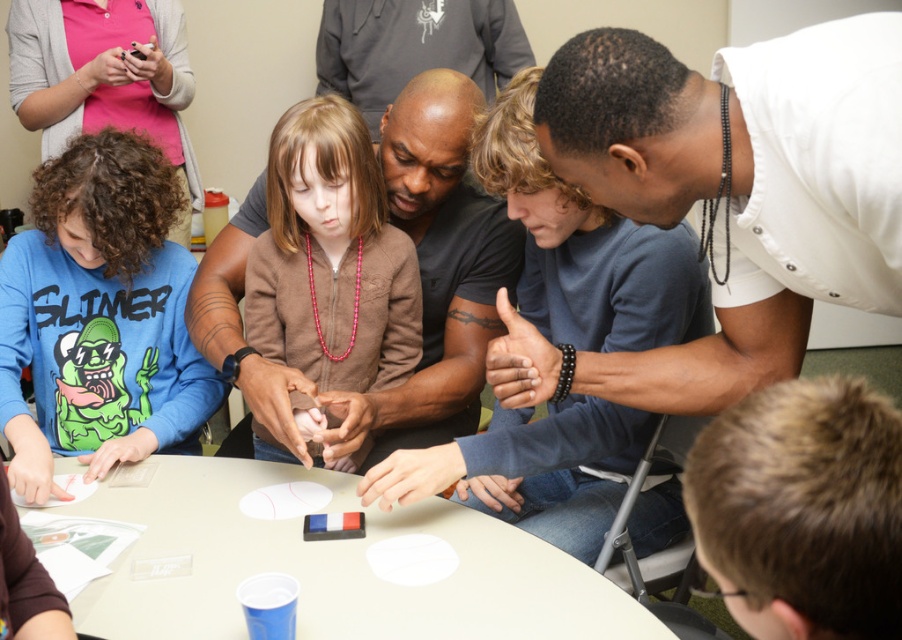
Question: Which object is farther from the camera taking this photo?

Choices:
 (A) smooth black shirt at center
 (B) white plastic table at center
 (C) blue cotton shirt at lower left

Answer: (C)

Question: Which is nearer to the white plastic table at center?

Choices:
 (A) smooth black shirt at center
 (B) brown matte sweater at center

Answer: (A)

Question: Can you confirm if blue cotton shirt at lower left is positioned below brown matte sweater at center?

Choices:
 (A) yes
 (B) no

Answer: (A)

Question: Is blue cotton shirt at lower left closer to camera compared to smooth black shirt at center?

Choices:
 (A) yes
 (B) no

Answer: (B)

Question: Estimate the real-world distances between objects in this image. Which object is closer to the brown matte sweater at center?

Choices:
 (A) white plastic table at center
 (B) blue cotton shirt at lower left
 (C) smooth black shirt at center

Answer: (C)

Question: Is blue cotton shirt at lower left to the right of brown matte sweater at center from the viewer's perspective?

Choices:
 (A) yes
 (B) no

Answer: (B)